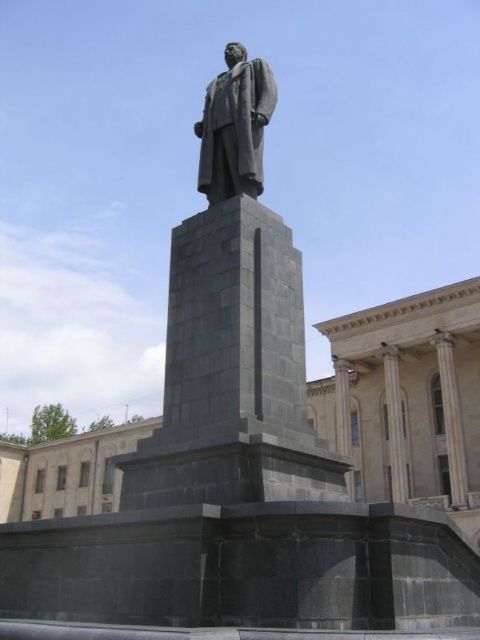
Question: Can you confirm if bronze statue at center is positioned below white marble pillar at center?

Choices:
 (A) yes
 (B) no

Answer: (B)

Question: Which point is farther to the camera?

Choices:
 (A) matte gray statue at center
 (B) bronze statue at center
 (C) white marble pillar at center

Answer: (C)

Question: Among these objects, which one is nearest to the camera?

Choices:
 (A) bronze statue at center
 (B) white marble pillar at center
 (C) matte gray statue at center

Answer: (C)

Question: Is matte gray statue at center positioned in front of bronze statue at center?

Choices:
 (A) no
 (B) yes

Answer: (B)

Question: Which of the following is the farthest from the observer?

Choices:
 (A) [404, 429]
 (B) [229, 72]

Answer: (A)

Question: Can you confirm if bronze statue at center is smaller than white marble pillar at center?

Choices:
 (A) yes
 (B) no

Answer: (A)